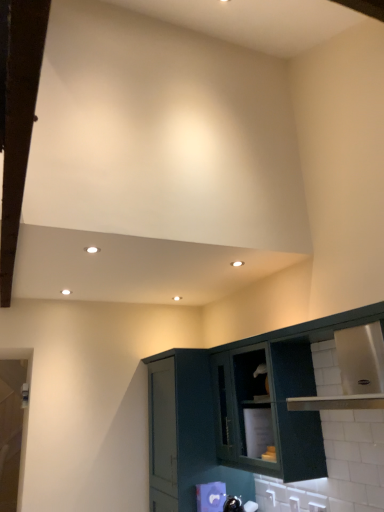
Question: Considering the positions of stainless steel cabinet at lower right, which is the second cabinetry from left to right, and white plastic electric outlet at lower right, acting as the 3th electric outlet starting from the left, in the image, is stainless steel cabinet at lower right, which is the second cabinetry from left to right, wider or thinner than white plastic electric outlet at lower right, acting as the 3th electric outlet starting from the left,?

Choices:
 (A) thin
 (B) wide

Answer: (B)

Question: Is stainless steel cabinet at lower right, marked as the 1th cabinetry in a right-to-left arrangement, situated inside white plastic electric outlet at lower right, which is the third electric outlet in back-to-front order, or outside?

Choices:
 (A) inside
 (B) outside

Answer: (B)

Question: Which object is positioned farthest from the white plastic electric outlet at lower right, the 2th electric outlet viewed from the front?

Choices:
 (A) green matte cabinet at lower right, the 2th cabinetry in the right-to-left sequence
 (B) matte dark green cabinet at lower right
 (C) white plastic electric outlet at lower right, which is the third electric outlet in back-to-front order
 (D) white plastic electric outlet at lower right, which ranks as the 1th electric outlet in left-to-right order
 (E) stainless steel cabinet at lower right, marked as the 1th cabinetry in a right-to-left arrangement

Answer: (A)

Question: Which is nearer to the white plastic electric outlet at lower right, the 2th electric outlet viewed from the front?

Choices:
 (A) matte dark green cabinet at lower right
 (B) white plastic electric outlet at lower right, which is the third electric outlet in back-to-front order
 (C) stainless steel cabinet at lower right, which is the second cabinetry from left to right
 (D) green matte cabinet at lower right, the 2th cabinetry in the right-to-left sequence
 (E) white plastic electric outlet at lower right, which ranks as the 1th electric outlet in left-to-right order

Answer: (B)